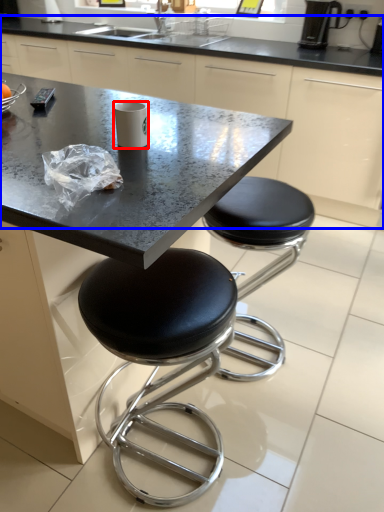
Question: Which of the following is the farthest to the observer, paper cup (highlighted by a red box) or counter (highlighted by a blue box)?

Choices:
 (A) paper cup
 (B) counter

Answer: (B)